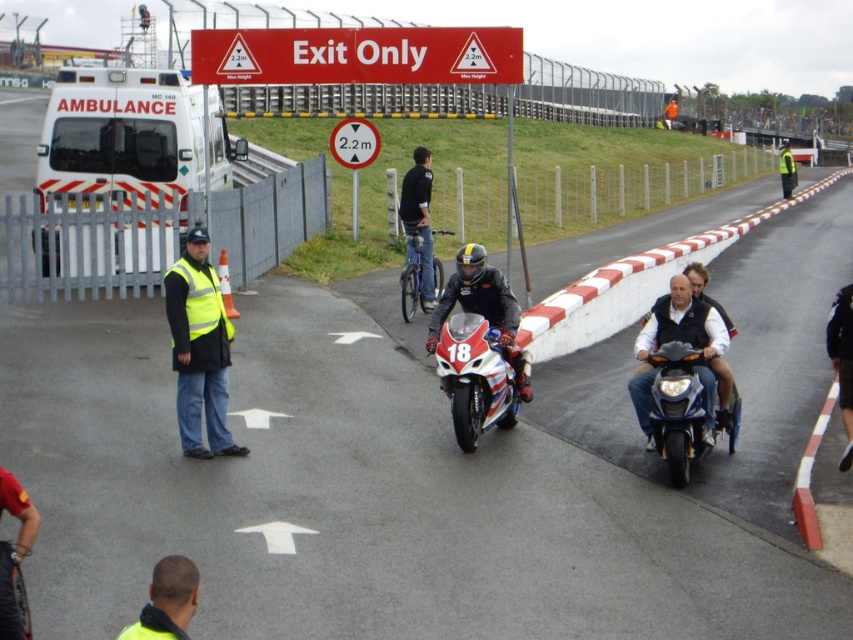
Is point (672, 381) closer to viewer compared to point (463, 259)?

Yes.

Who is shorter, shiny blue motorcycle at center or shiny black motorcycle at center?

Standing shorter between the two is shiny blue motorcycle at center.

Where is `shiny blue motorcycle at center`? shiny blue motorcycle at center is located at coordinates (679, 408).

Describe the element at coordinates (167, 602) in the screenshot. I see `yellow reflective vest at lower center` at that location.

Is yellow reflective vest at lower center bigger than black matte bicycle at center?

No, yellow reflective vest at lower center is not bigger than black matte bicycle at center.

The height and width of the screenshot is (640, 853). What do you see at coordinates (167, 602) in the screenshot? I see `yellow reflective vest at lower center` at bounding box center [167, 602].

Identify the location of yellow reflective vest at lower center. (167, 602).

Which of these two, white matte ambulance at left or black matte bicycle at center, stands shorter?

With less height is black matte bicycle at center.

Which is more to the left, white matte ambulance at left or black matte bicycle at center?

white matte ambulance at left

Does point (122, 173) come behind point (421, 168)?

Yes, it is.

The image size is (853, 640). I want to click on white matte ambulance at left, so click(x=132, y=134).